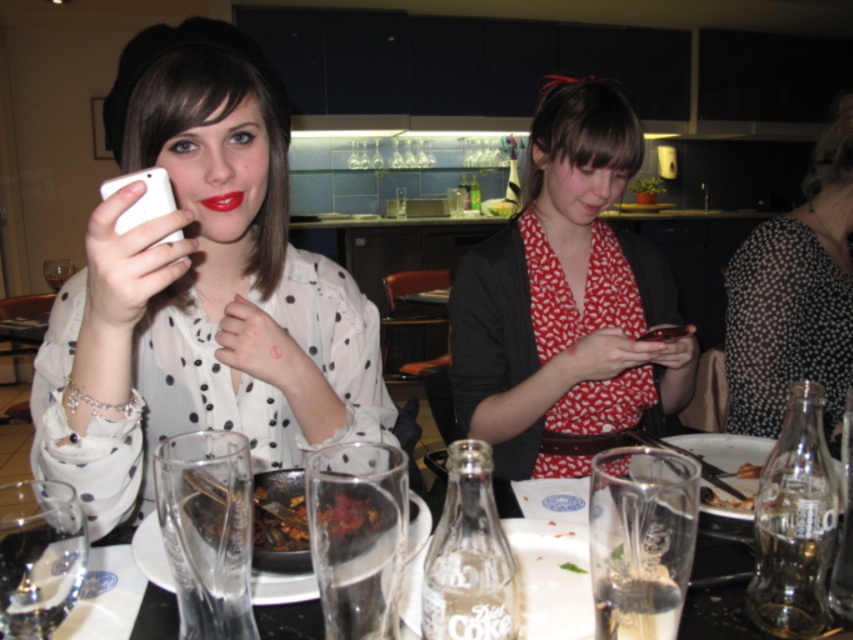
Can you confirm if matte red blouse at center is positioned to the left of clear glassware at lower center?

No, matte red blouse at center is not to the left of clear glassware at lower center.

Who is higher up, matte red blouse at center or clear glassware at lower center?

Positioned higher is matte red blouse at center.

From the picture: Who is more distant from viewer, (521, 291) or (692, 609)?

Positioned behind is point (521, 291).

This screenshot has width=853, height=640. I want to click on matte red blouse at center, so click(566, 296).

Does matte red blouse at center appear on the right side of black dotted dress at right?

No, matte red blouse at center is not to the right of black dotted dress at right.

The image size is (853, 640). In order to click on matte red blouse at center in this screenshot , I will do `click(566, 296)`.

Identify the location of matte red blouse at center. (566, 296).

Does dark brown glossy food at center appear on the left side of matte red lipstick at center?

No, dark brown glossy food at center is not to the left of matte red lipstick at center.

Locate an element on the screen. dark brown glossy food at center is located at coordinates (279, 513).